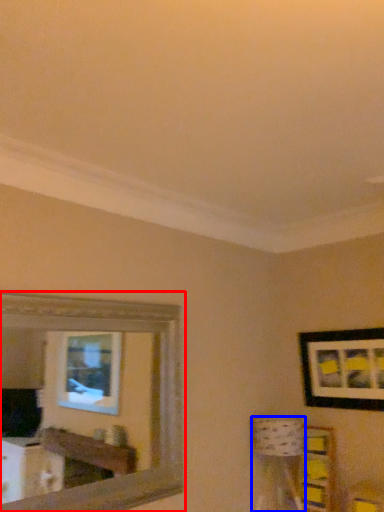
Question: Which point is closer to the camera, mirror (highlighted by a red box) or table lamp (highlighted by a blue box)?

Choices:
 (A) mirror
 (B) table lamp

Answer: (A)